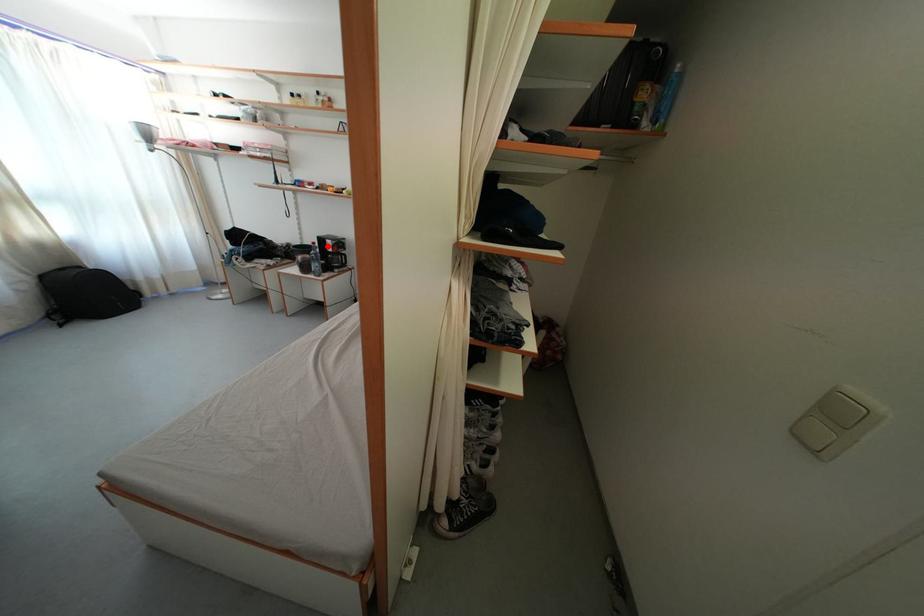
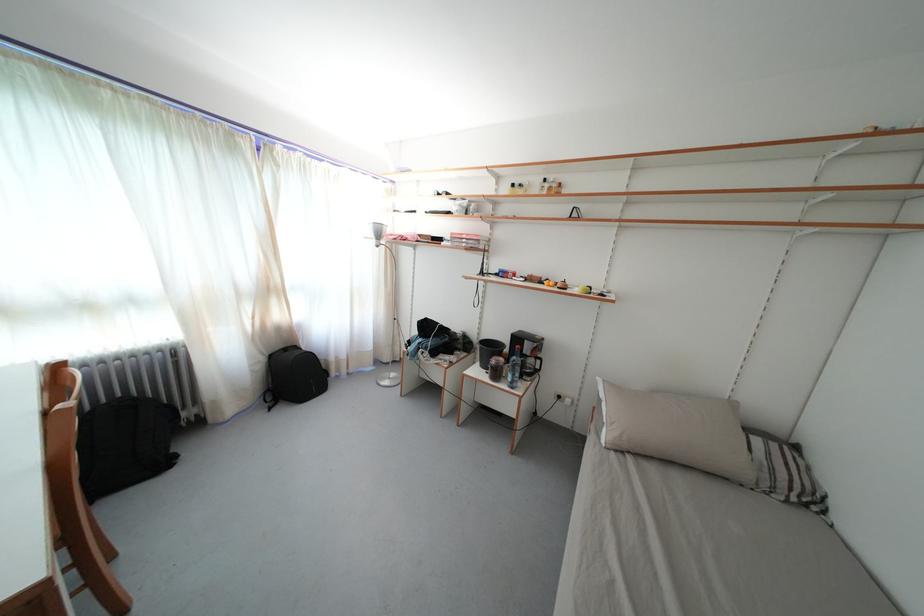
The point at the highlighted location is marked in the first image. Where is the corresponding point in the second image?

(524, 345)